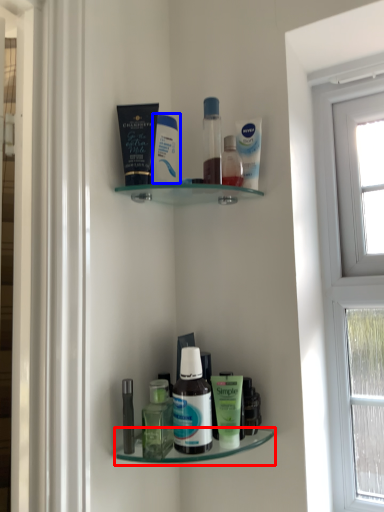
Question: Among these objects, which one is farthest to the camera, shelf (highlighted by a red box) or cleaning product (highlighted by a blue box)?

Choices:
 (A) shelf
 (B) cleaning product

Answer: (B)